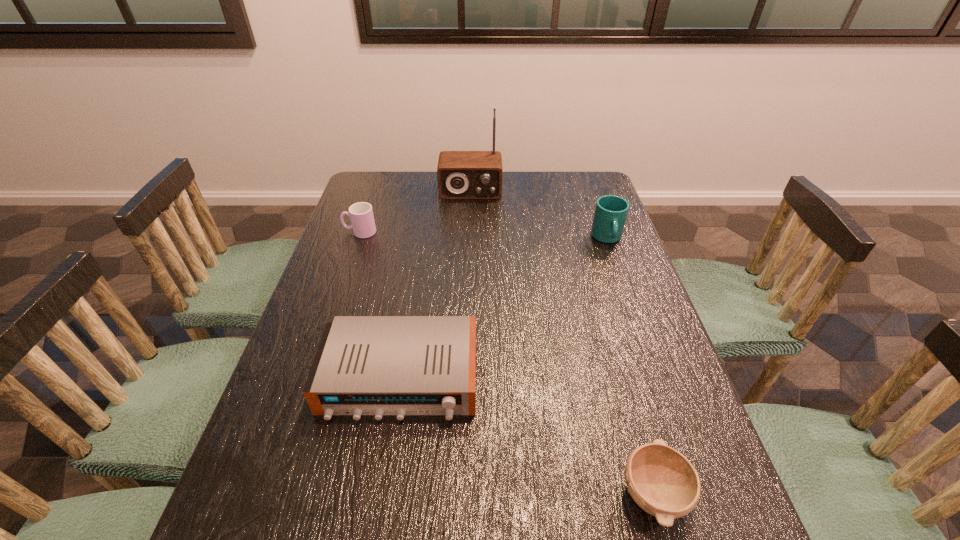
This screenshot has width=960, height=540. I want to click on free region at the right edge of the desktop, so click(657, 366).

Image resolution: width=960 pixels, height=540 pixels. In order to click on vacant space at the far left corner in this screenshot , I will do `click(367, 171)`.

Find the location of a particular element. The width and height of the screenshot is (960, 540). empty space that is in between the fourth shortest object and the nearest object is located at coordinates (630, 366).

The height and width of the screenshot is (540, 960). In order to click on free space between the shorter cup and the right cup in this screenshot , I will do `click(484, 235)`.

Identify the location of free space between the bowl and the right cup. (630, 366).

Where is `empty space between the nearer radio receiver and the left cup`? empty space between the nearer radio receiver and the left cup is located at coordinates (380, 305).

This screenshot has width=960, height=540. I want to click on free point between the nearest object and the nearer radio receiver, so click(527, 436).

I want to click on free area in between the nearest object and the shorter cup, so click(x=507, y=363).

In order to click on unoccupied position between the taller radio receiver and the second nearest object in this screenshot , I will do `click(436, 285)`.

Where is `vacant point located between the nearest object and the shorter radio receiver`? The width and height of the screenshot is (960, 540). vacant point located between the nearest object and the shorter radio receiver is located at coordinates (527, 436).